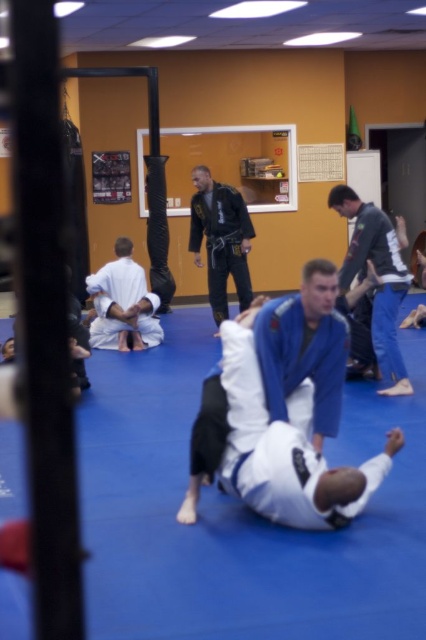
You are a camera operator trying to capture the martial arts training session. The director wants to zoom in on the blue matte kimono at center. What are the coordinates where you should focus the camera?

The coordinates for the blue matte kimono at center are at point (302, 348).

You are a martial arts instructor observing a training session. You notice two students wearing the blue matte kimono at center and the white matte kimono at center. Which student is wearing the larger kimono?

The blue matte kimono at center has a larger size compared to the white matte kimono at center, so the student wearing the blue matte kimono at center is the one with the larger kimono.

You are a photographer setting up for a martial arts competition. The blue matte kimono at center is at point [302,348]. Where should you position your camera to capture the blue matte kimono at center in the center of the frame?

→ To center the blue matte kimono at center in the frame, position the camera so that its lens aligns with the coordinates [302,348], ensuring the kimono is at the focal point of the image.